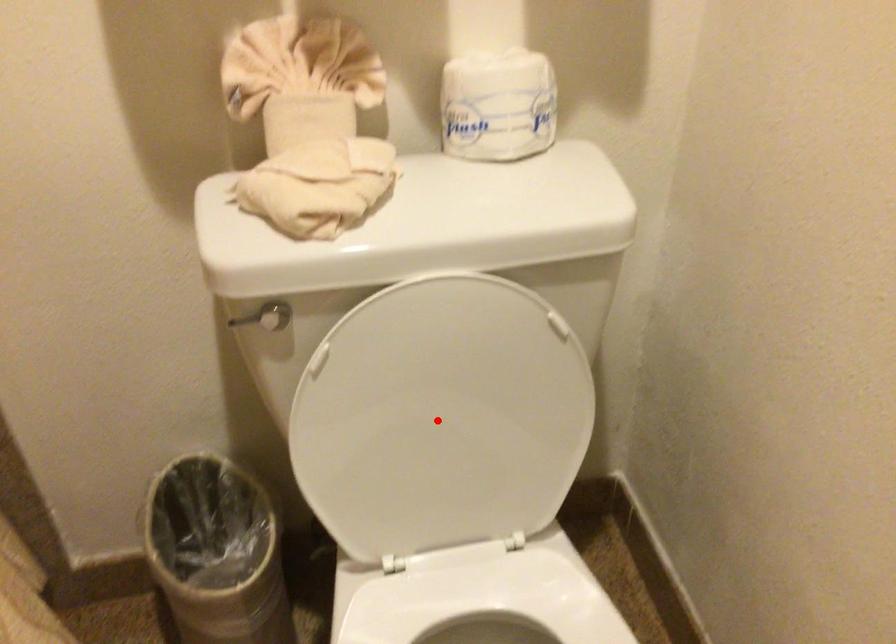
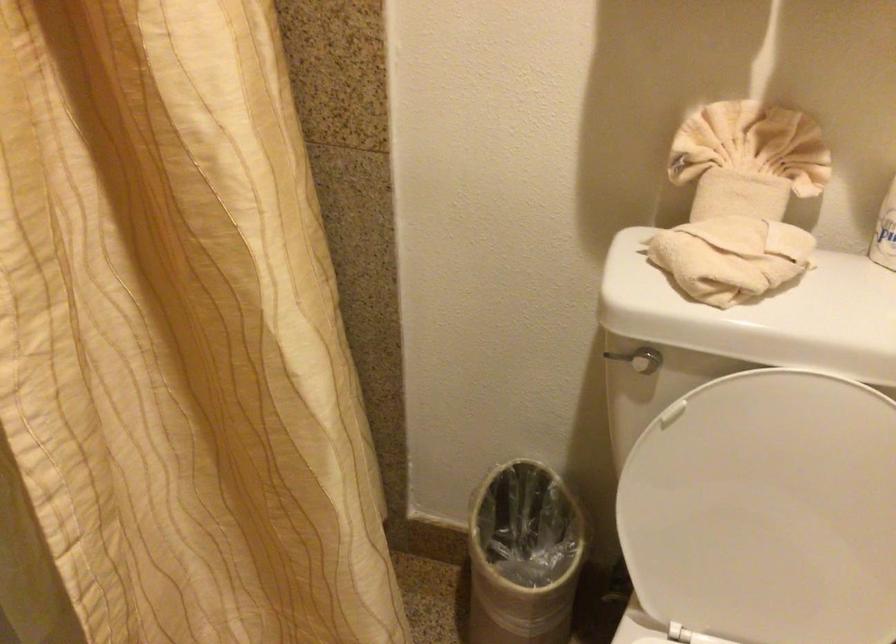
Question: I am providing you with two images of the same scene from different viewpoints. A red point is marked on the first image. At the location where the point appears in image 1, is it still visible in image 2?

Choices:
 (A) Yes
 (B) No

Answer: (A)